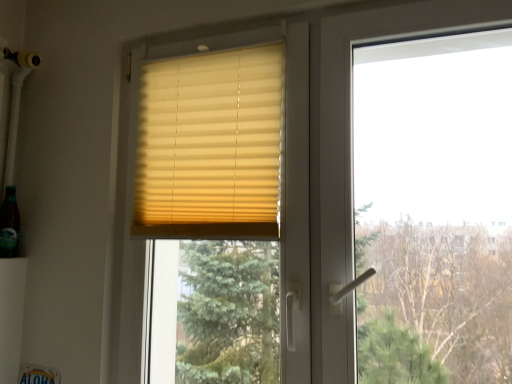
Question: Is translucent glass bottle at lower left positioned in front of beige fabric blinds at upper center?

Choices:
 (A) yes
 (B) no

Answer: (B)

Question: Is translucent glass bottle at lower left to the right of beige fabric blinds at upper center from the viewer's perspective?

Choices:
 (A) no
 (B) yes

Answer: (A)

Question: Are translucent glass bottle at lower left and beige fabric blinds at upper center far apart?

Choices:
 (A) no
 (B) yes

Answer: (A)

Question: Is translucent glass bottle at lower left positioned behind beige fabric blinds at upper center?

Choices:
 (A) no
 (B) yes

Answer: (B)

Question: Is translucent glass bottle at lower left bigger than beige fabric blinds at upper center?

Choices:
 (A) no
 (B) yes

Answer: (A)

Question: From a real-world perspective, does translucent glass bottle at lower left stand above beige fabric blinds at upper center?

Choices:
 (A) no
 (B) yes

Answer: (A)

Question: Does beige fabric blinds at upper center have a greater width compared to translucent glass bottle at lower left?

Choices:
 (A) yes
 (B) no

Answer: (B)

Question: Can you confirm if beige fabric blinds at upper center is positioned to the left of translucent glass bottle at lower left?

Choices:
 (A) yes
 (B) no

Answer: (B)

Question: Considering the relative sizes of beige fabric blinds at upper center and translucent glass bottle at lower left in the image provided, is beige fabric blinds at upper center smaller than translucent glass bottle at lower left?

Choices:
 (A) yes
 (B) no

Answer: (B)

Question: Is translucent glass bottle at lower left at the back of beige fabric blinds at upper center?

Choices:
 (A) no
 (B) yes

Answer: (A)

Question: Could translucent glass bottle at lower left be considered to be inside beige fabric blinds at upper center?

Choices:
 (A) yes
 (B) no

Answer: (B)

Question: Does beige fabric blinds at upper center have a greater height compared to translucent glass bottle at lower left?

Choices:
 (A) no
 (B) yes

Answer: (B)

Question: In terms of width, does translucent glass bottle at lower left look wider or thinner when compared to beige fabric blinds at upper center?

Choices:
 (A) thin
 (B) wide

Answer: (B)